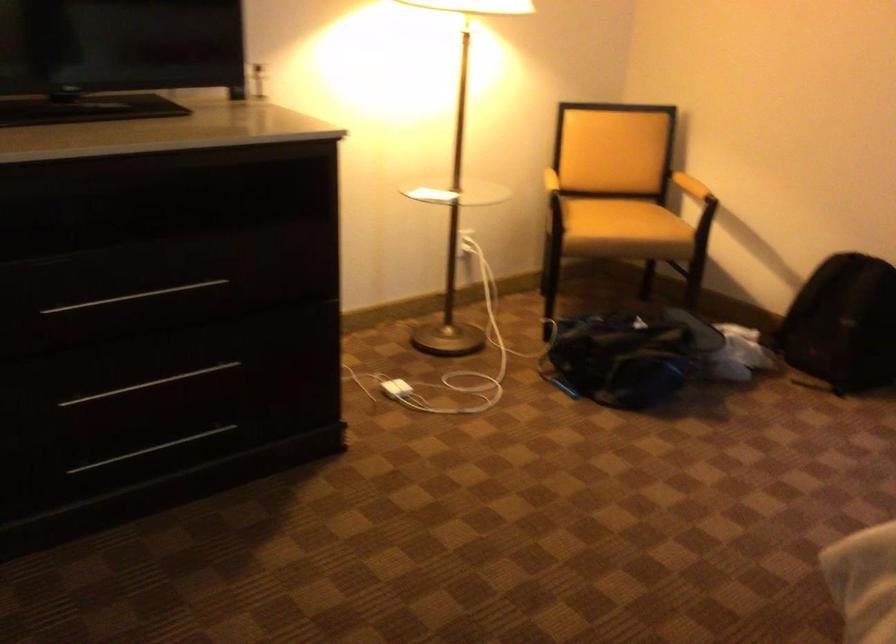
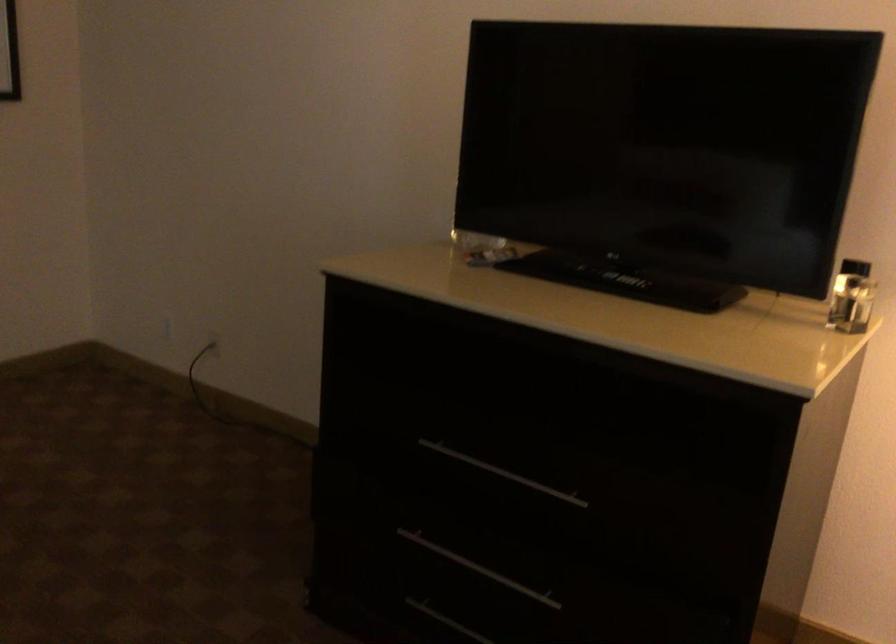
Locate, in the second image, the point that corresponds to [87,108] in the first image.

(625, 279)